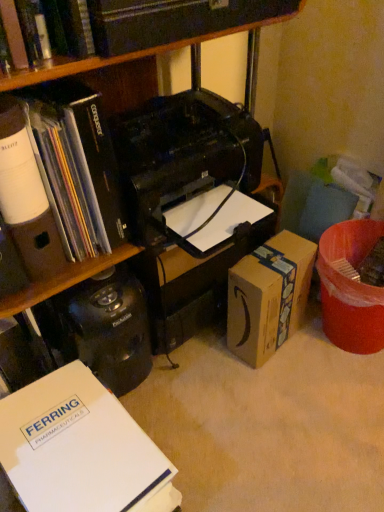
What are the coordinates of `free space that is to the left of brown cardboard box at lower right` in the screenshot? It's located at (203, 354).